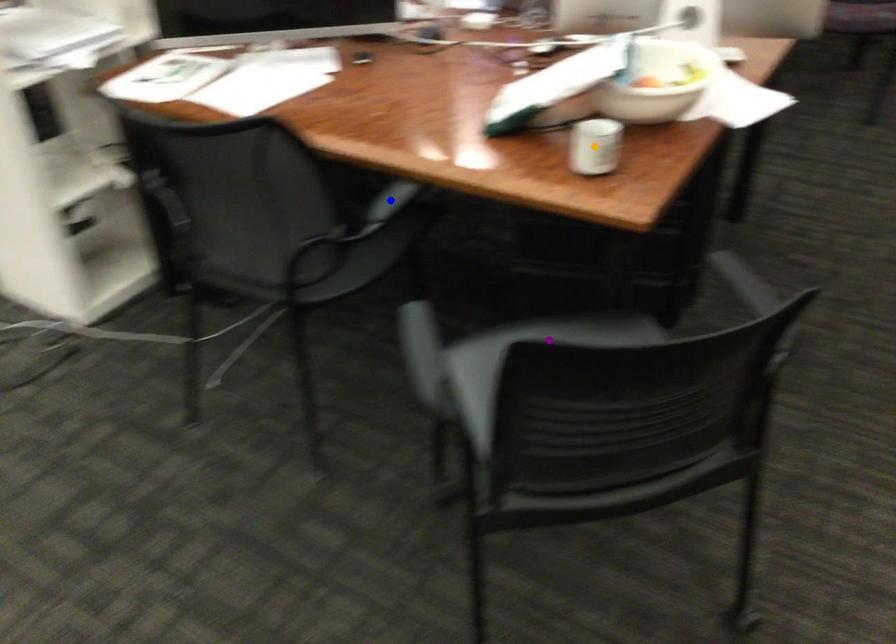
Order these from nearest to farthest:
A) purple point
B) blue point
C) orange point

purple point < orange point < blue point